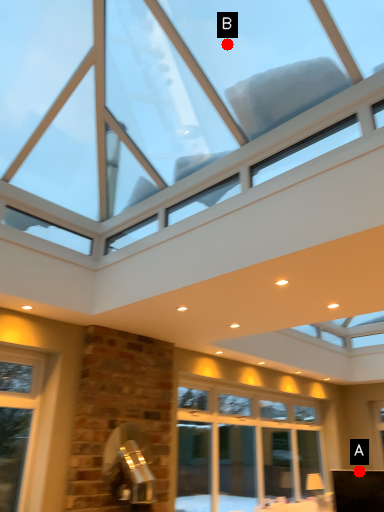
Question: Two points are circled on the image, labeled by A and B beside each circle. Which point is farther to the camera?

Choices:
 (A) A is further
 (B) B is further

Answer: (A)